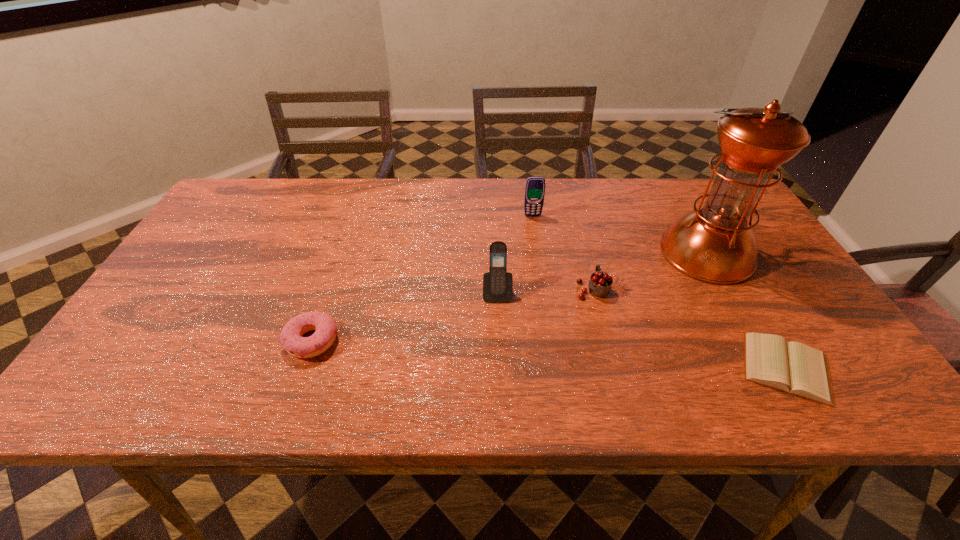
Where is `oil lamp`? The height and width of the screenshot is (540, 960). oil lamp is located at coordinates (715, 243).

Image resolution: width=960 pixels, height=540 pixels. Find the location of `the nearer cellular telephone`. the nearer cellular telephone is located at coordinates (497, 283).

This screenshot has width=960, height=540. I want to click on the second object from left to right, so click(497, 283).

Locate an element on the screen. the farther cellular telephone is located at coordinates (535, 186).

I want to click on the third object from left to right, so click(x=535, y=186).

Where is `cherry`? Image resolution: width=960 pixels, height=540 pixels. cherry is located at coordinates (600, 284).

Find the location of a particular element. This screenshot has width=960, height=540. the fourth tallest object is located at coordinates (600, 284).

This screenshot has width=960, height=540. What are the coordinates of `the leftmost object` in the screenshot? It's located at (291, 339).

Image resolution: width=960 pixels, height=540 pixels. I want to click on the second shortest object, so click(291, 339).

Find the location of a particular element. The image size is (960, 540). the shortest object is located at coordinates (795, 368).